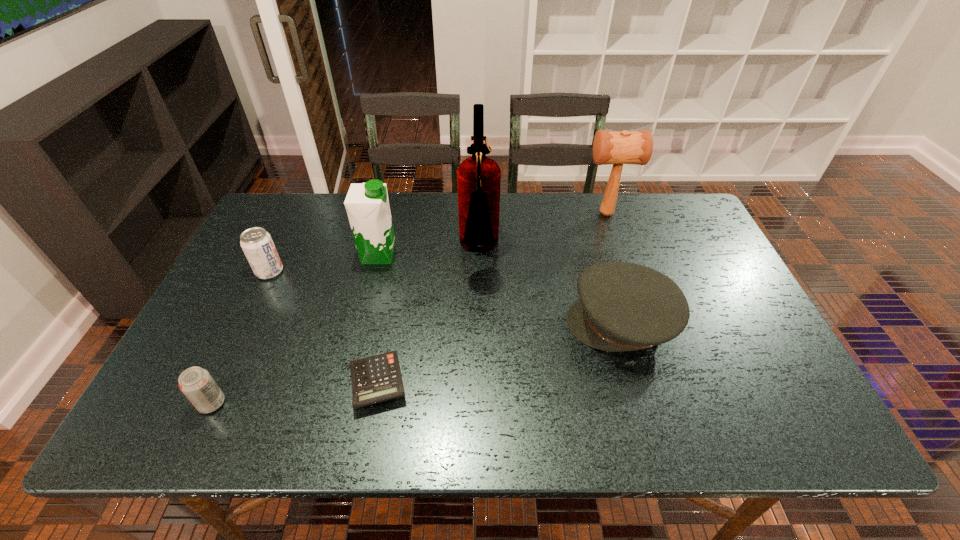
You are a GUI agent. You are given a task and a screenshot of the screen. Output one action in this format:
    pyautogui.click(x=<x>, y=<y>)
    Task: Click on the vacant space located on the strike surface of the mallet
    
    Given the screenshot: What is the action you would take?
    pyautogui.click(x=516, y=214)

Image resolution: width=960 pixels, height=540 pixels. What are the coordinates of `free spot located on the strike surface of the mallet` in the screenshot? It's located at (490, 214).

Image resolution: width=960 pixels, height=540 pixels. I want to click on vacant space located 0.390m on the strike surface of the mallet, so click(x=462, y=214).

Find the location of `blank space located on the front-facing side of the fifth shortest object`. blank space located on the front-facing side of the fifth shortest object is located at coordinates (451, 255).

Find the location of a particular element. free region located 0.180m on the back of the taller soda can is located at coordinates (293, 224).

Identify the location of vacant space located 0.370m on the front-facing side of the beret. The height and width of the screenshot is (540, 960). (421, 322).

The image size is (960, 540). What are the coordinates of `vacant space positioned on the front-facing side of the beret` in the screenshot? It's located at (448, 322).

Find the location of a particular element. This screenshot has width=960, height=540. vacant region located on the front-facing side of the beret is located at coordinates (500, 322).

In order to click on free space located 0.110m on the back of the shorter soda can in this screenshot , I will do `click(237, 350)`.

I want to click on vacant space located 0.310m on the left of the calculator, so click(x=208, y=382).